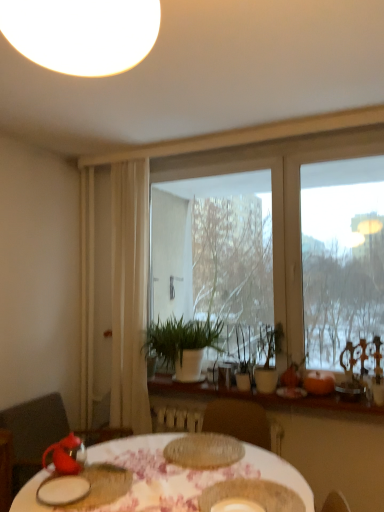
I want to click on free area in between white ceramic plate at lower left, which appears as the 9th tableware when viewed from the right, and matte ceramic bowl at center, which is the 7th tableware from left to right, so click(x=148, y=492).